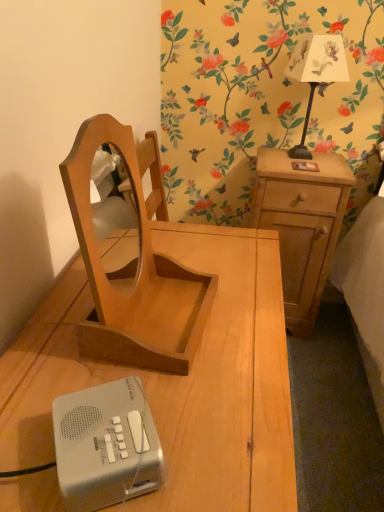
The height and width of the screenshot is (512, 384). I want to click on empty space that is to the right of silver plastic radio at lower left, so click(x=220, y=436).